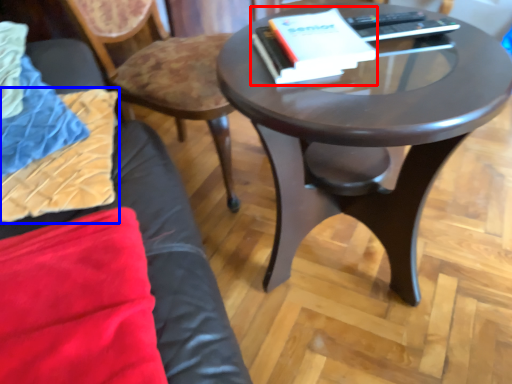
Question: Which of the following is the closest to the observer, paperback book (highlighted by a red box) or pillow (highlighted by a blue box)?

Choices:
 (A) paperback book
 (B) pillow

Answer: (B)